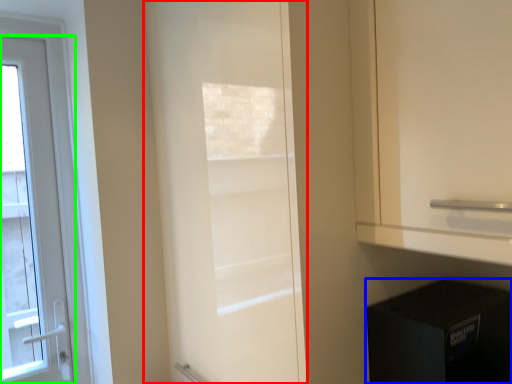
Question: Which object is the farthest from door (highlighted by a red box)? Choose among these: appliance (highlighted by a blue box) or door (highlighted by a green box).

Choices:
 (A) appliance
 (B) door

Answer: (B)